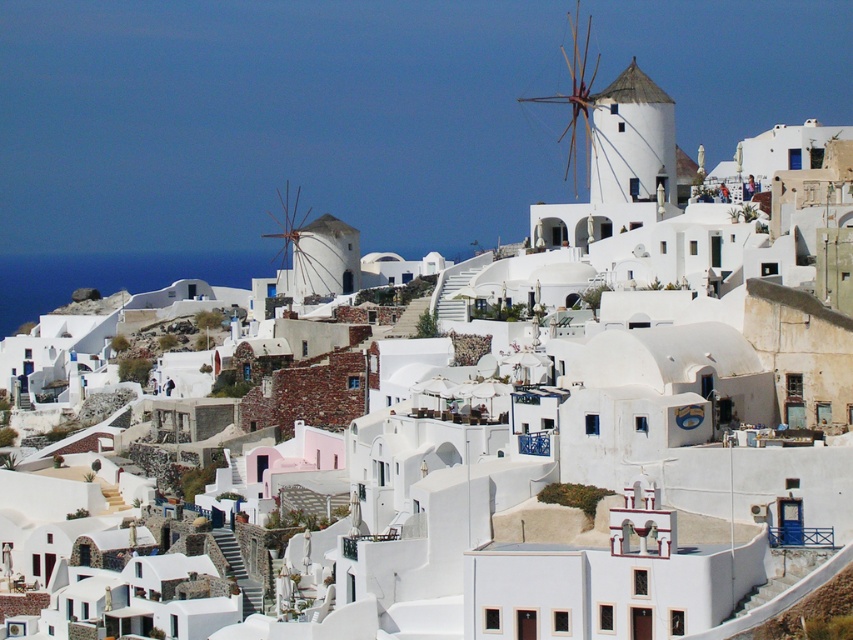
Question: Which point is farther to the camera?

Choices:
 (A) white wooden windmill at upper center
 (B) white matte windmill at center

Answer: (B)

Question: Which object is closer to the camera taking this photo?

Choices:
 (A) white wooden windmill at upper center
 (B) white matte windmill at center

Answer: (A)

Question: Is white matte windmill at center positioned at the back of white wooden windmill at upper center?

Choices:
 (A) no
 (B) yes

Answer: (B)

Question: Which point appears closest to the camera in this image?

Choices:
 (A) (585, 132)
 (B) (354, 269)

Answer: (B)

Question: Can you confirm if white matte windmill at center is positioned above white wooden windmill at upper center?

Choices:
 (A) yes
 (B) no

Answer: (B)

Question: Is white matte windmill at center below white wooden windmill at upper center?

Choices:
 (A) yes
 (B) no

Answer: (A)